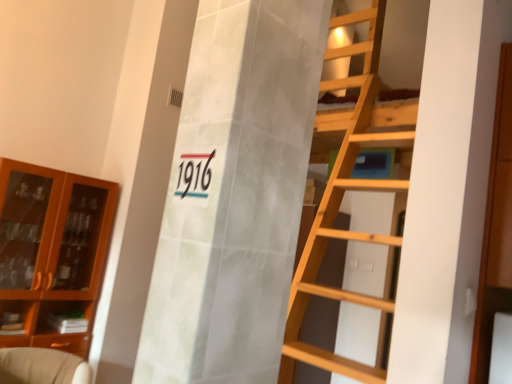
Question: From the image's perspective, is brown glass cabinet at left, arranged as the 2th cabinetry when viewed from the right, above or below beige fabric armchair at lower left?

Choices:
 (A) below
 (B) above

Answer: (B)

Question: From a real-world perspective, relative to beige fabric armchair at lower left, is brown glass cabinet at left, arranged as the 2th cabinetry when viewed from the right, vertically above or below?

Choices:
 (A) above
 (B) below

Answer: (A)

Question: Considering the real-world distances, which object is farthest from the black glossy number at center?

Choices:
 (A) brown glass cabinet at left, which appears as the second cabinetry when viewed from the front
 (B) wooden cabinet at right, which appears as the first cabinetry when viewed from the front
 (C) beige fabric armchair at lower left

Answer: (A)

Question: Considering the real-world distances, which object is closest to the wooden cabinet at right, which appears as the first cabinetry when viewed from the front?

Choices:
 (A) brown glass cabinet at left, which appears as the 1th cabinetry when viewed from the back
 (B) beige fabric armchair at lower left
 (C) black glossy number at center

Answer: (C)